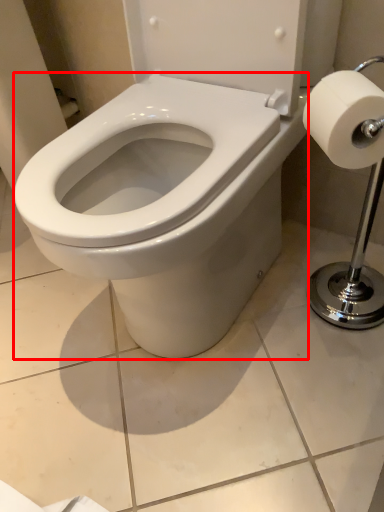
Question: Where is bidet (annotated by the red box) located in relation to toilet paper in the image?

Choices:
 (A) left
 (B) right

Answer: (A)